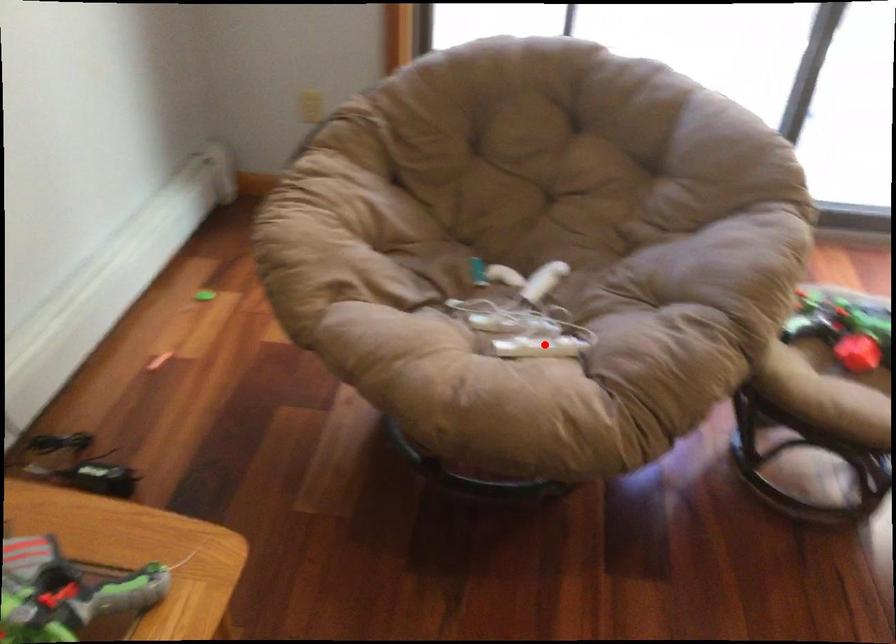
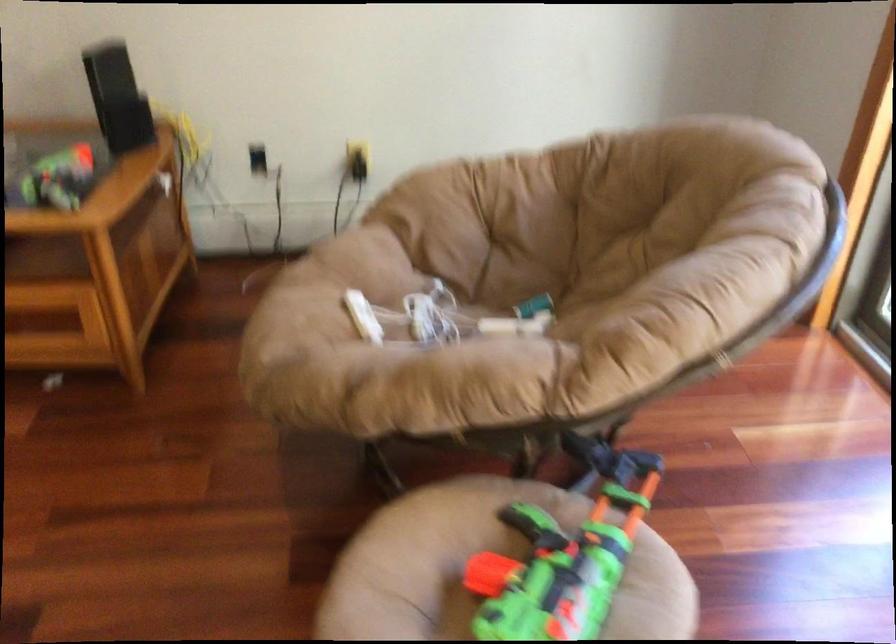
Locate, in the second image, the point that corresponds to the highlighted location in the first image.

(363, 317)